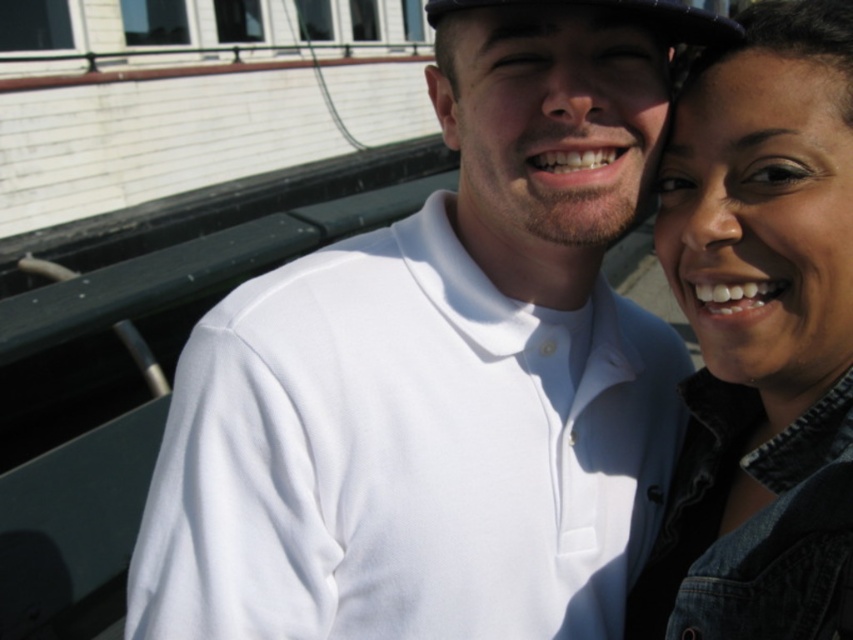
You are trying to decide which item to grab first between the denim jacket at upper right and the black fabric baseball hat at upper center. If you can only carry one item and want to choose the wider one, which should you pick?

The black fabric baseball hat at upper center is wider than the denim jacket at upper right, so you should pick the black fabric baseball hat at upper center.

You are a photographer trying to capture a candid shot of the two people in the scene. Since you want to ensure both subjects are fully visible, will the white matte shirt at center block the view of the denim jacket at upper right?

The white matte shirt at center is positioned under the denim jacket at upper right, so the denim jacket at upper right will still be visible above the white matte shirt at center. The photographer can capture both subjects without obstruction.

You are a photographer trying to capture a clear photo of both the denim jacket at upper right and the black fabric baseball hat at upper center. However, you notice that one is blocking the other. Which object is currently obscuring the other?

The denim jacket at upper right is in front of the black fabric baseball hat at upper center, so the denim jacket is obscuring the black fabric baseball hat.